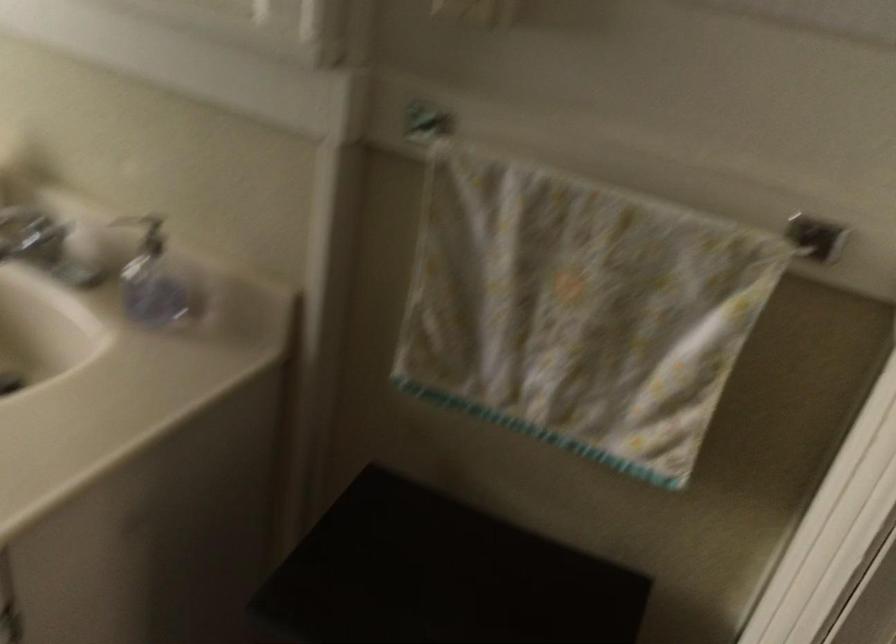
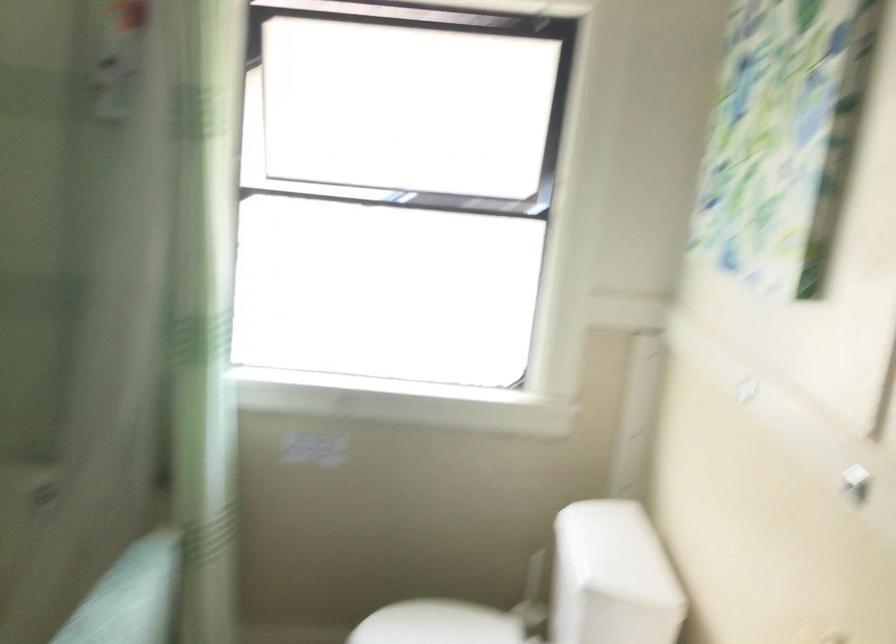
Question: Based on the continuous images, in which direction is the camera rotating? Reply with the corresponding letter.

Choices:
 (A) Left
 (B) Right
 (C) Up
 (D) Down

Answer: (A)